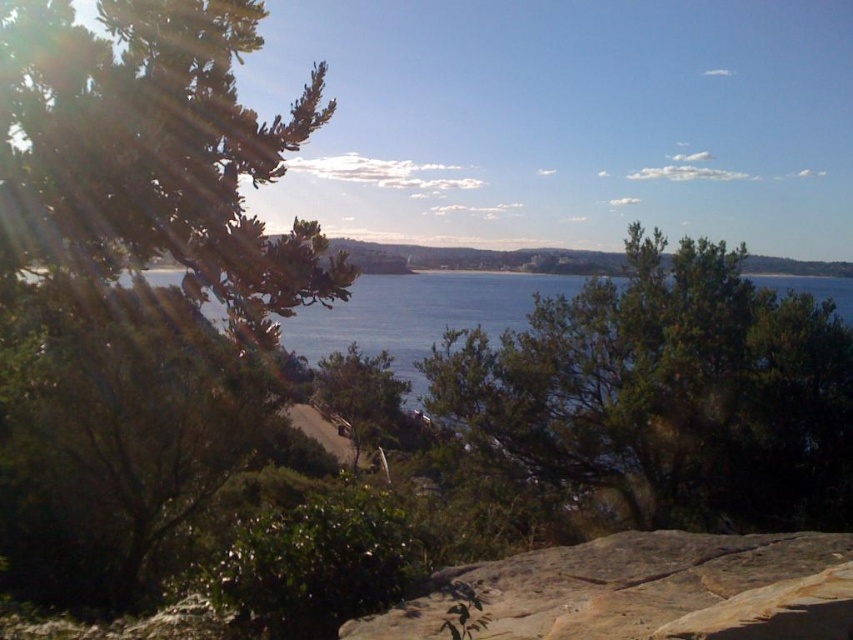
Who is positioned more to the left, green leafy tree at left or green leafy tree at center?

From the viewer's perspective, green leafy tree at left appears more on the left side.

Consider the image. Does green leafy tree at left have a greater width compared to green leafy tree at center?

In fact, green leafy tree at left might be narrower than green leafy tree at center.

Which is in front, point (193, 365) or point (566, 372)?

Point (193, 365) is more forward.

Where is `green leafy tree at left`? green leafy tree at left is located at coordinates (141, 253).

Is green leafy tree at center shorter than brown rough rock at lower center?

No, green leafy tree at center is not shorter than brown rough rock at lower center.

Which is behind, point (810, 387) or point (624, 560)?

The point (810, 387) is behind.

The width and height of the screenshot is (853, 640). I want to click on green leafy tree at center, so 669,392.

Locate an element on the screen. The height and width of the screenshot is (640, 853). green leafy tree at center is located at coordinates (669, 392).

Does green leafy tree at left appear under brown rough rock at lower center?

No.

Is green leafy tree at left wider than brown rough rock at lower center?

Indeed, green leafy tree at left has a greater width compared to brown rough rock at lower center.

Locate an element on the screen. The width and height of the screenshot is (853, 640). green leafy tree at left is located at coordinates pos(141,253).

The image size is (853, 640). What are the coordinates of `green leafy tree at left` in the screenshot? It's located at (141, 253).